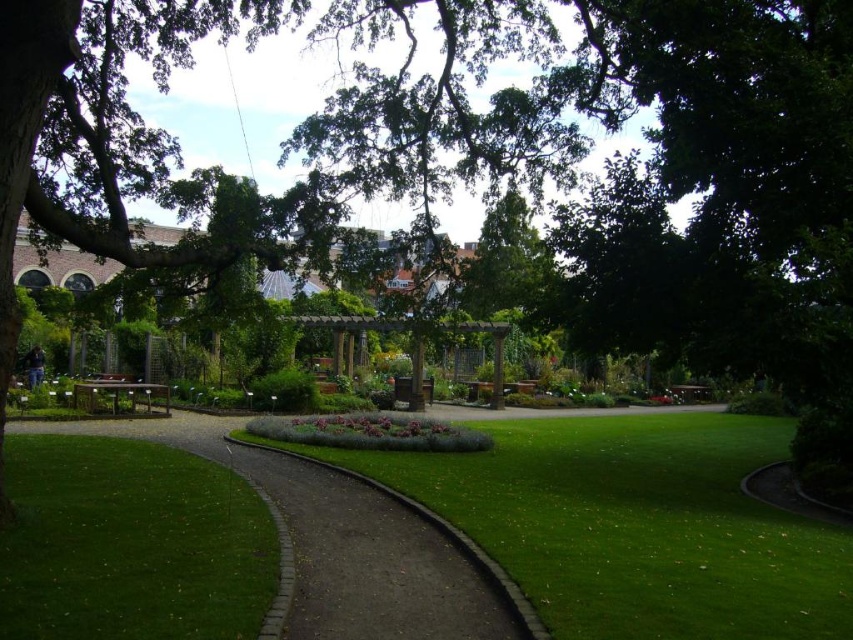
Can you confirm if green grass at lower left is bigger than brown brick path at center?

Incorrect, green grass at lower left is not larger than brown brick path at center.

Is point (44, 632) farther from camera compared to point (399, 637)?

No, (44, 632) is in front of (399, 637).

At what (x,y) coordinates should I click in order to perform the action: click on green grass at lower left. Please return your answer as a coordinate pair (x, y). Looking at the image, I should click on (131, 544).